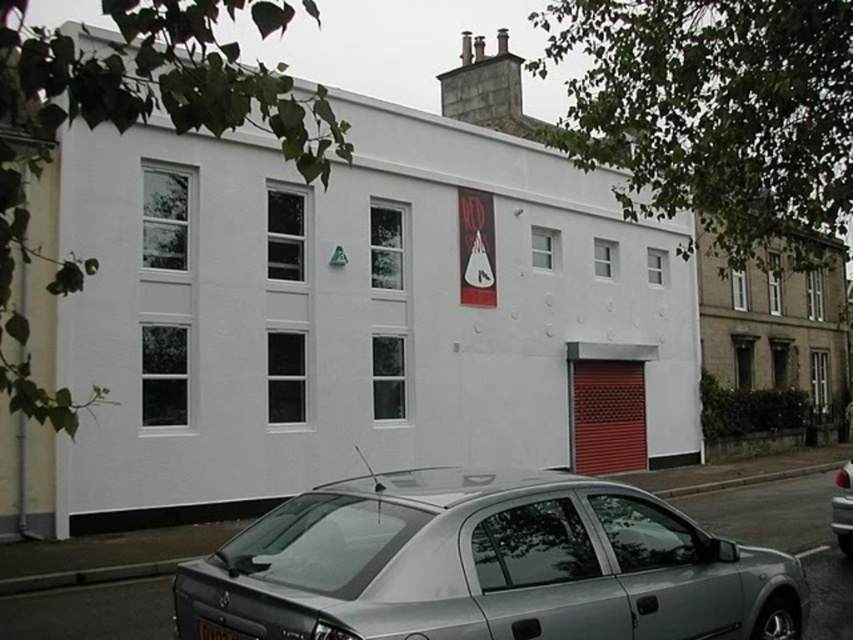
You are a delivery person who needs to park your vehicle near the building. You see a silver metallic car at lower right and a black plastic license plate at lower center. Which object is closer to the ground?

The silver metallic car at lower right is below the black plastic license plate at lower center, so it is closer to the ground.

You are a delivery person trying to park your van between the satin silver sedan at lower center and the silver metallic car at lower right. Can you fit your van, which is 2.5 meters wide, in the available space between them?

The satin silver sedan at lower center has a lesser width compared to silver metallic car at lower right, but the exact distance between them isn not provided. Without knowing the space between the two cars, it is impossible to determine if the van can fit.